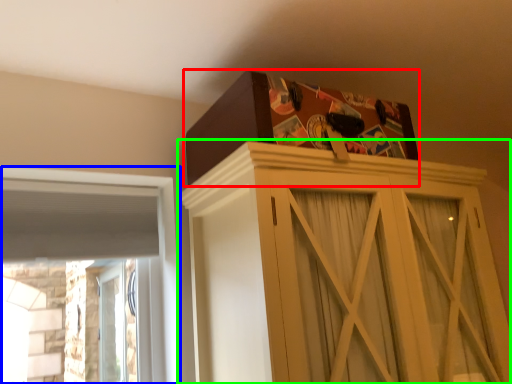
Question: Based on their relative distances, which object is nearer to cardboard box (highlighted by a red box)? Choose from window (highlighted by a blue box) and cupboard (highlighted by a green box).

Choices:
 (A) window
 (B) cupboard

Answer: (B)